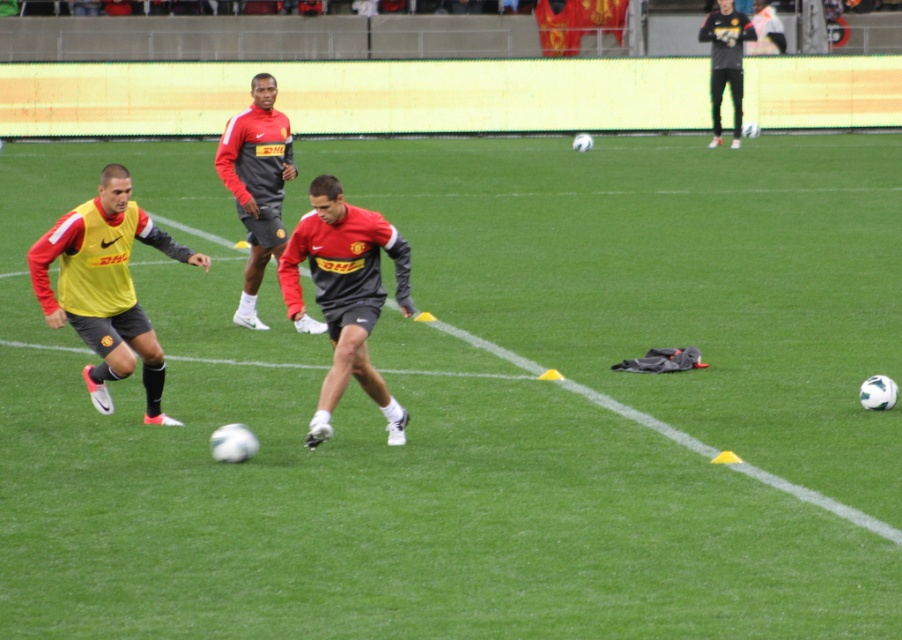
Question: Among these objects, which one is farthest from the camera?

Choices:
 (A) black matte pants at upper right
 (B) yellow matte jersey at left
 (C) matte red and black jersey at center
 (D) matte red shirt at center

Answer: (A)

Question: Does yellow matte jersey at left appear on the left side of black matte pants at upper right?

Choices:
 (A) no
 (B) yes

Answer: (B)

Question: Can you confirm if matte red and black jersey at center is wider than black matte pants at upper right?

Choices:
 (A) yes
 (B) no

Answer: (B)

Question: Which point appears farthest from the camera in this image?

Choices:
 (A) (114, 163)
 (B) (252, 88)
 (C) (383, 291)
 (D) (715, 44)

Answer: (D)

Question: Which object is farther from the camera taking this photo?

Choices:
 (A) matte red and black jersey at center
 (B) matte red shirt at center
 (C) yellow matte jersey at left

Answer: (B)

Question: Can you confirm if matte red and black jersey at center is bigger than black matte pants at upper right?

Choices:
 (A) yes
 (B) no

Answer: (B)